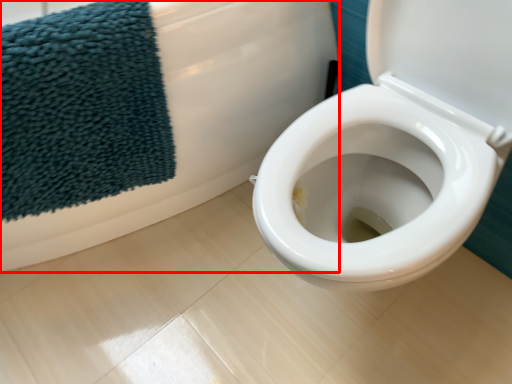
Question: Where is bath (annotated by the red box) located in relation to beach towel in the image?

Choices:
 (A) left
 (B) right

Answer: (A)